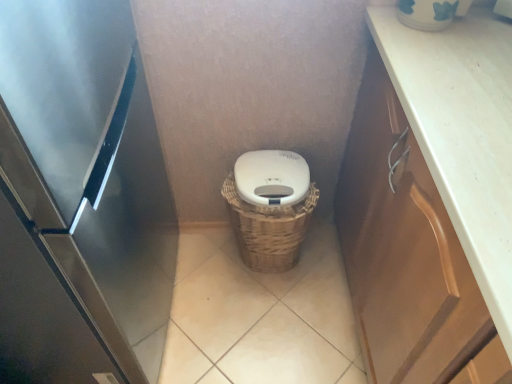
At what (x,y) coordinates should I click in order to perform the action: click on spots to the right of woven brown basket at center. Please return your answer as a coordinate pair (x, y). Looking at the image, I should click on (327, 269).